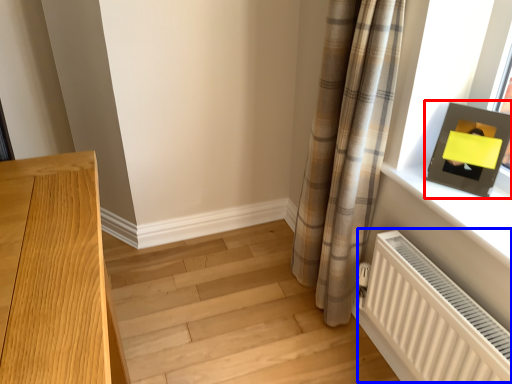
Question: Which of the following is the closest to the observer, picture frame (highlighted by a red box) or radiator (highlighted by a blue box)?

Choices:
 (A) picture frame
 (B) radiator

Answer: (B)